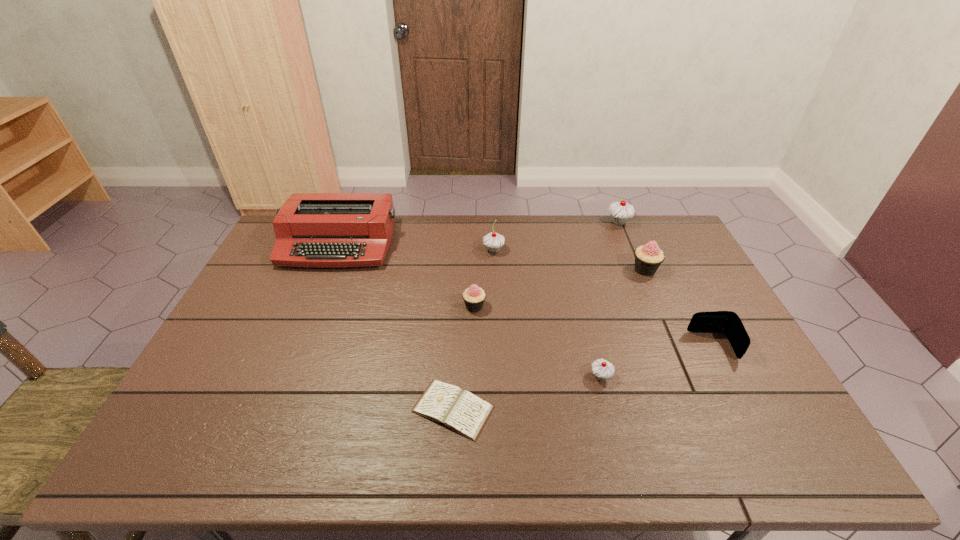
Find the location of `vacant space located 0.180m on the outer surface of the wallet`. vacant space located 0.180m on the outer surface of the wallet is located at coordinates (627, 346).

The image size is (960, 540). Identify the location of vacant space positioned 0.390m on the outer surface of the wallet. (552, 346).

In order to click on free spot located on the outer surface of the wallet in this screenshot , I will do `click(638, 346)`.

This screenshot has height=540, width=960. I want to click on vacant position located on the back of the diary, so click(459, 291).

The width and height of the screenshot is (960, 540). In order to click on typewriter that is at the far edge in this screenshot , I will do `click(317, 230)`.

You are a GUI agent. You are given a task and a screenshot of the screen. Output one action in this format:
    pyautogui.click(x=<x>, y=<y>)
    Task: Click on the object located in the near edge section of the desktop
    The width and height of the screenshot is (960, 540).
    Given the screenshot: What is the action you would take?
    pyautogui.click(x=463, y=412)

You are a GUI agent. You are given a task and a screenshot of the screen. Output one action in this format:
    pyautogui.click(x=<x>, y=<y>)
    Task: Click on the object that is positioned at the left edge
    Image resolution: width=960 pixels, height=540 pixels.
    Given the screenshot: What is the action you would take?
    pyautogui.click(x=317, y=230)

I want to click on wallet located at the right edge, so click(728, 322).

Where is `object that is at the far left corner`? The height and width of the screenshot is (540, 960). object that is at the far left corner is located at coordinates (317, 230).

Locate an element on the screen. The image size is (960, 540). object that is at the far right corner is located at coordinates (620, 212).